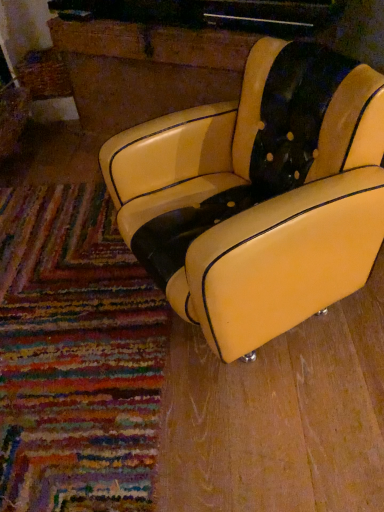
In order to face matte yellow leather chair at center, should I rotate leftwards or rightwards?

You should look right and rotate roughly 5.719 degrees.

Locate an element on the screen. matte yellow leather chair at center is located at coordinates (258, 195).

Image resolution: width=384 pixels, height=512 pixels. What do you see at coordinates (258, 195) in the screenshot? I see `matte yellow leather chair at center` at bounding box center [258, 195].

At what (x,y) coordinates should I click in order to perform the action: click on matte yellow leather chair at center. Please return your answer as a coordinate pair (x, y). Looking at the image, I should click on (258, 195).